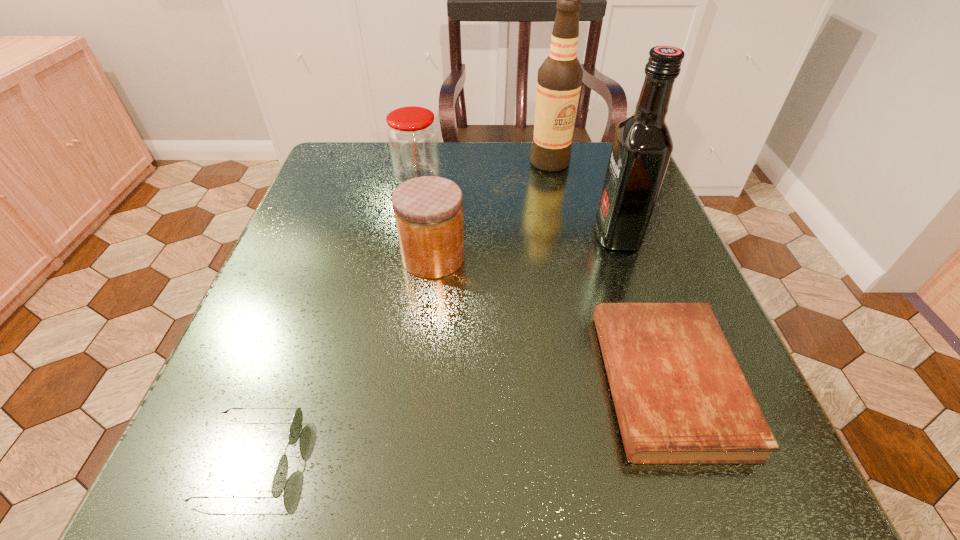
Find the location of `object at the left edge`. object at the left edge is located at coordinates (279, 481).

You are a GUI agent. You are given a task and a screenshot of the screen. Output one action in this format:
    pyautogui.click(x=<x>, y=<y>)
    Task: Click on the alcohol that is at the right edge
    This screenshot has width=960, height=540.
    Given the screenshot: What is the action you would take?
    pyautogui.click(x=559, y=80)

This screenshot has height=540, width=960. What are the coordinates of `liquor present at the right edge` in the screenshot? It's located at (642, 147).

I want to click on Bible located in the right edge section of the desktop, so click(x=680, y=396).

Locate an element on the screen. The height and width of the screenshot is (540, 960). object positioned at the near left corner is located at coordinates (279, 481).

At what (x,y) coordinates should I click in order to perform the action: click on object that is at the far right corner. Please return your answer as a coordinate pair (x, y). Looking at the image, I should click on (559, 80).

Where is `object at the near right corner`? object at the near right corner is located at coordinates (680, 396).

In the image, there is a desktop. Identify the location of vacant space at the far edge. The width and height of the screenshot is (960, 540). (459, 144).

Where is `free space at the near edge of the desktop`? free space at the near edge of the desktop is located at coordinates (391, 483).

Locate an element on the screen. vacant space at the left edge of the desktop is located at coordinates (352, 278).